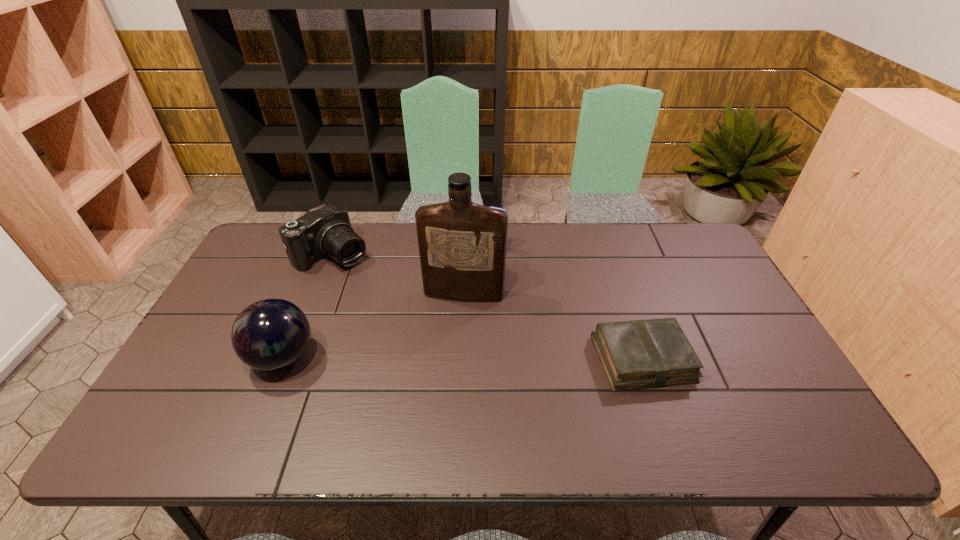
Identify the location of camera that is positioned at the far edge. This screenshot has width=960, height=540. (325, 230).

Find the location of a particular element. The image size is (960, 540). bowling ball that is at the near edge is located at coordinates (271, 334).

This screenshot has width=960, height=540. Find the location of `book present at the near edge`. book present at the near edge is located at coordinates (638, 354).

You are a GUI agent. You are given a task and a screenshot of the screen. Output one action in this format:
    pyautogui.click(x=<x>, y=<y>)
    Task: Click on the bowling ball that is at the left edge
    
    Given the screenshot: What is the action you would take?
    pyautogui.click(x=271, y=334)

Find the location of `camera positioned at the left edge`. camera positioned at the left edge is located at coordinates coord(325,230).

Locate an element on the screen. The height and width of the screenshot is (540, 960). object that is at the far left corner is located at coordinates (325, 230).

What are the coordinates of `object present at the near left corner` in the screenshot? It's located at (271, 334).

This screenshot has width=960, height=540. Find the location of `free space at the far edge of the desktop`. free space at the far edge of the desktop is located at coordinates (397, 230).

Locate an element on the screen. This screenshot has height=540, width=960. vacant space at the near edge of the desktop is located at coordinates (730, 400).

At what (x,y) coordinates should I click in order to perform the action: click on vacant space at the left edge. Please return your answer as a coordinate pair (x, y). The image size is (960, 540). Looking at the image, I should click on (213, 359).